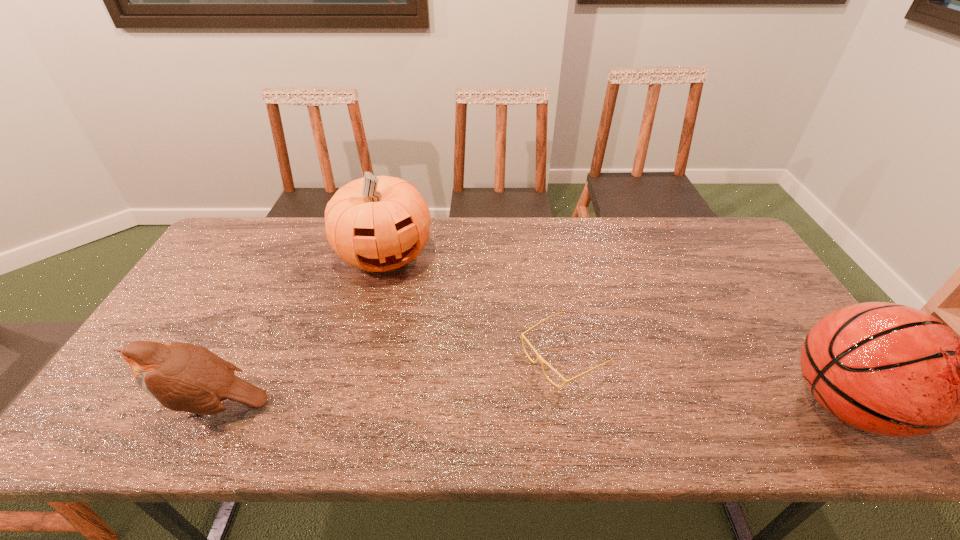
Find the location of a particular element. Image resolution: width=960 pixels, height=540 pixels. vacant region located in front of the lenses of the shortest object is located at coordinates (511, 387).

Locate an element on the screen. The image size is (960, 540). blank space located on the front-facing side of the pumpkin is located at coordinates (436, 383).

Identify the location of vacant space located on the front-facing side of the pumpkin. The width and height of the screenshot is (960, 540). 402,300.

Where is `vacant region located on the front-facing side of the pumpkin`? The width and height of the screenshot is (960, 540). vacant region located on the front-facing side of the pumpkin is located at coordinates (425, 356).

Where is `object at the far edge`? This screenshot has width=960, height=540. object at the far edge is located at coordinates (377, 223).

Where is `bird at the near edge`? bird at the near edge is located at coordinates (185, 377).

You are a GUI agent. You are given a task and a screenshot of the screen. Output one action in this format:
    pyautogui.click(x=<x>, y=<y>)
    Task: Click on the basketball at the near edge
    This screenshot has height=540, width=960.
    Given the screenshot: What is the action you would take?
    pyautogui.click(x=888, y=369)

Identify the location of spectacles at the near edge. (539, 357).

I want to click on object at the left edge, so click(x=185, y=377).

You are a GUI agent. You are given a task and a screenshot of the screen. Output one action in this format:
    pyautogui.click(x=<x>, y=<y>)
    Task: Click on the object present at the right edge
    The height and width of the screenshot is (540, 960).
    Given the screenshot: What is the action you would take?
    pyautogui.click(x=888, y=369)